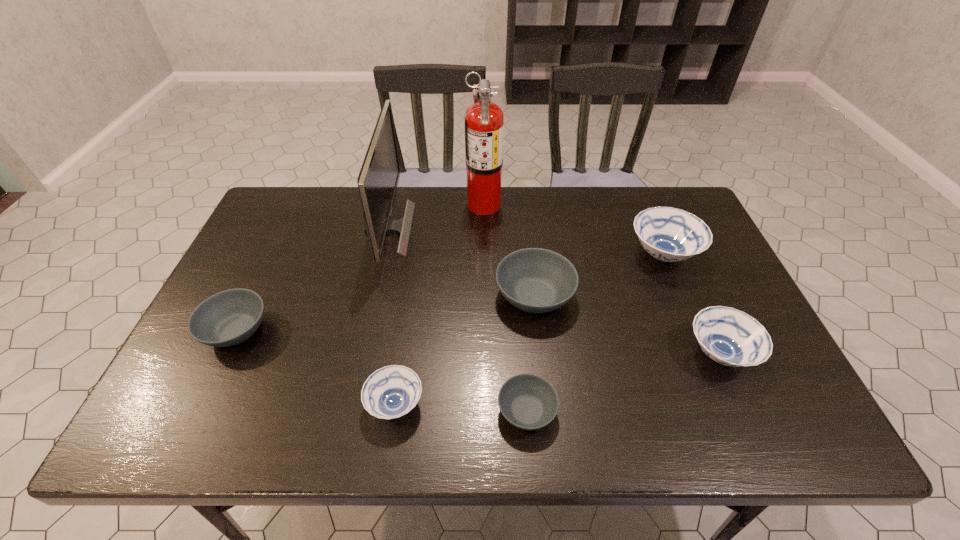
Select which gray soup bowl appears as the second closest to the leftmost gray soup bowl. Please provide its 2D coordinates. Your answer should be formatted as a tuple, i.e. [(x, y)], where the tuple contains the x and y coordinates of a point satisfying the conditions above.

[(527, 401)]

Find the location of `vacant region that satisfies the following two spatial constraints: 1. on the screen side of the monitor; 2. on the back side of the second smallest blue soup bowl`. vacant region that satisfies the following two spatial constraints: 1. on the screen side of the monitor; 2. on the back side of the second smallest blue soup bowl is located at coordinates (360, 354).

What are the coordinates of `free space that satisfies the following two spatial constraints: 1. on the back side of the biggest blue soup bowl; 2. on the right side of the biggest gray soup bowl` in the screenshot? It's located at (530, 254).

Locate an element on the screen. vacant position in the image that satisfies the following two spatial constraints: 1. on the back side of the biggest gray soup bowl; 2. on the nozzle side of the fire extinguisher is located at coordinates (524, 204).

At what (x,y) coordinates should I click in order to perform the action: click on free spot that satisfies the following two spatial constraints: 1. on the screen side of the second biggest blue soup bowl; 2. on the left side of the seventh shortest object. Please return your answer as a coordinate pair (x, y). Image resolution: width=960 pixels, height=540 pixels. Looking at the image, I should click on (360, 354).

Find the location of `vacant region that satisfies the following two spatial constraints: 1. on the screen side of the monitor; 2. on the back side of the nearest gray soup bowl`. vacant region that satisfies the following two spatial constraints: 1. on the screen side of the monitor; 2. on the back side of the nearest gray soup bowl is located at coordinates (348, 411).

I want to click on free space that satisfies the following two spatial constraints: 1. on the screen side of the second tallest object; 2. on the right side of the biggest gray soup bowl, so click(x=373, y=296).

I want to click on free region that satisfies the following two spatial constraints: 1. on the screen side of the second tallest object; 2. on the left side of the biggest blue soup bowl, so click(x=383, y=254).

I want to click on free spot that satisfies the following two spatial constraints: 1. on the screen side of the monitor; 2. on the back side of the leftmost blue soup bowl, so click(x=349, y=404).

Locate an element on the screen. This screenshot has height=540, width=960. free space in the image that satisfies the following two spatial constraints: 1. on the screen side of the seventh shortest object; 2. on the left side of the biggest gray soup bowl is located at coordinates (373, 296).